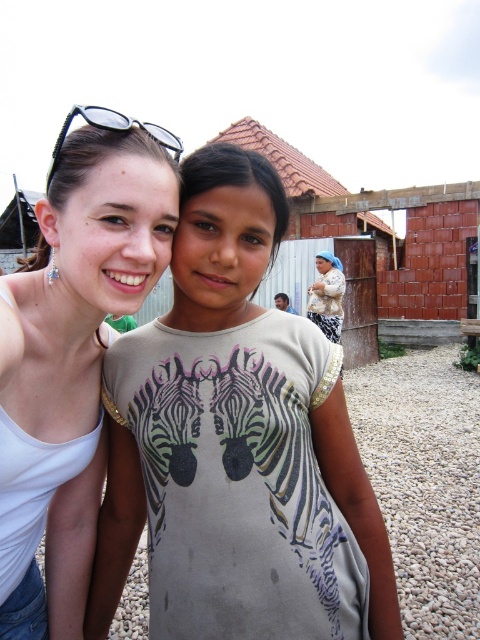
Question: Which object is farther from the camera taking this photo?

Choices:
 (A) white matte tank top at upper left
 (B) sunglasses at upper left
 (C) beige textured shawl at center

Answer: (C)

Question: Can you confirm if white matte tank top at upper left is smaller than sunglasses at upper left?

Choices:
 (A) no
 (B) yes

Answer: (A)

Question: Which is nearer to the white matte tank top at upper left?

Choices:
 (A) light beige fabric dress at center
 (B) sunglasses at upper left

Answer: (A)

Question: Considering the relative positions of light beige fabric dress at center and sunglasses at upper left in the image provided, where is light beige fabric dress at center located with respect to sunglasses at upper left?

Choices:
 (A) left
 (B) right

Answer: (B)

Question: Considering the relative positions of beige textured shawl at center and sunglasses at upper left in the image provided, where is beige textured shawl at center located with respect to sunglasses at upper left?

Choices:
 (A) below
 (B) above

Answer: (B)

Question: Estimate the real-world distances between objects in this image. Which object is farther from the beige textured shawl at center?

Choices:
 (A) white matte tank top at upper left
 (B) light beige fabric dress at center
 (C) sunglasses at upper left

Answer: (C)